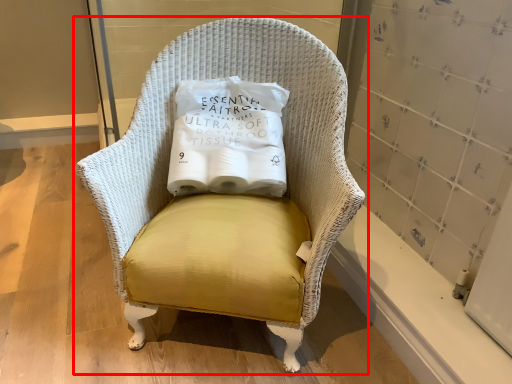
Question: From the image's perspective, what is the correct spatial relationship of chair (annotated by the red box) in relation to pillow?

Choices:
 (A) above
 (B) below

Answer: (B)